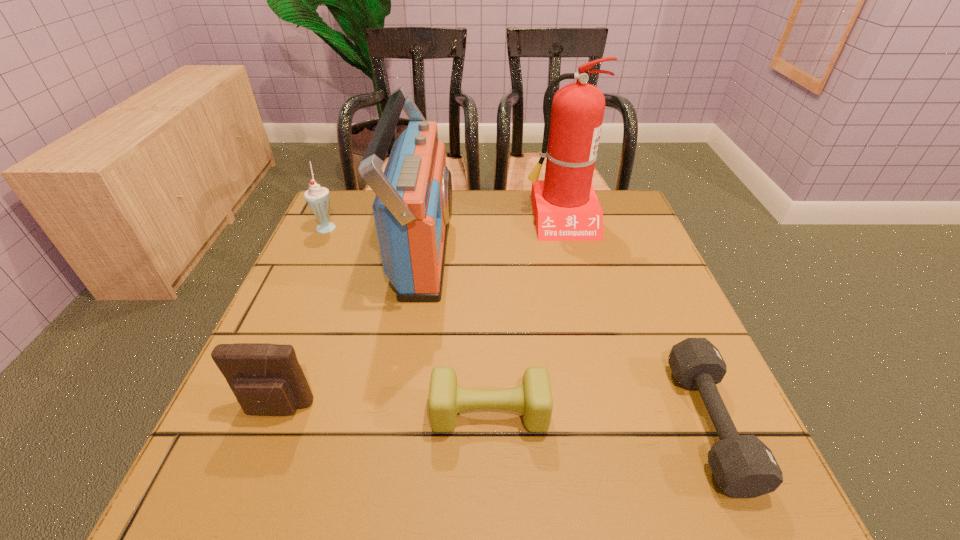
I want to click on the fifth closest object to the rightmost object, so click(x=318, y=198).

Find the location of a particular element. free location that satisfies the following two spatial constraints: 1. on the back side of the left dumbbell; 2. on the front-facing side of the radio receiver is located at coordinates (487, 251).

This screenshot has width=960, height=540. Find the location of `free location that satisfies the following two spatial constraints: 1. on the front-facing side of the right dumbbell; 2. on the right side of the fifth object from left to right`. free location that satisfies the following two spatial constraints: 1. on the front-facing side of the right dumbbell; 2. on the right side of the fifth object from left to right is located at coordinates [x=611, y=424].

You are a GUI agent. You are given a task and a screenshot of the screen. Output one action in this format:
    pyautogui.click(x=<x>, y=<y>)
    Task: Click on the vacant position in the image that satisfies the following two spatial constraints: 1. on the front-facing side of the fifth shortest object; 2. on the back side of the right dumbbell
    The height and width of the screenshot is (540, 960).
    Given the screenshot: What is the action you would take?
    pyautogui.click(x=396, y=424)

Find the location of a particular element. Image resolution: width=960 pixels, height=540 pixels. blank area in the image that satisfies the following two spatial constraints: 1. on the front-facing side of the fifth shortest object; 2. on the left side of the rightmost object is located at coordinates (396, 424).

Image resolution: width=960 pixels, height=540 pixels. Identify the location of free space that satisfies the following two spatial constraints: 1. on the front-facing side of the second object from right to left; 2. on the front-facing side of the fifth shortest object. (568, 251).

Where is `free region that satisfies the following two spatial constraints: 1. on the straw side of the milkshake; 2. on the right side of the left dumbbell`? The height and width of the screenshot is (540, 960). free region that satisfies the following two spatial constraints: 1. on the straw side of the milkshake; 2. on the right side of the left dumbbell is located at coordinates (241, 414).